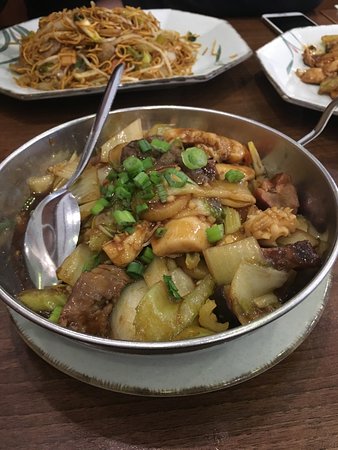
Find the location of `spoon`. spoon is located at coordinates (64, 217).